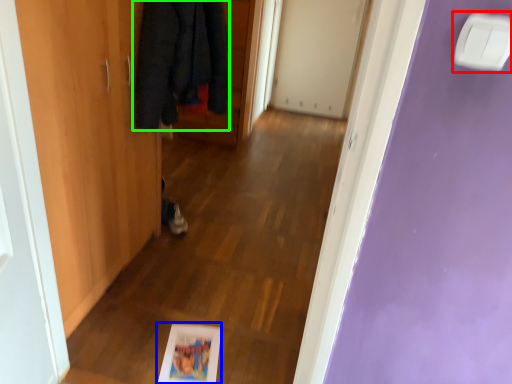
Question: Estimate the real-world distances between objects in this image. Which object is farther from light switch (highlighted by a red box), picture frame (highlighted by a blue box) or cloak (highlighted by a green box)?

Choices:
 (A) picture frame
 (B) cloak

Answer: (A)